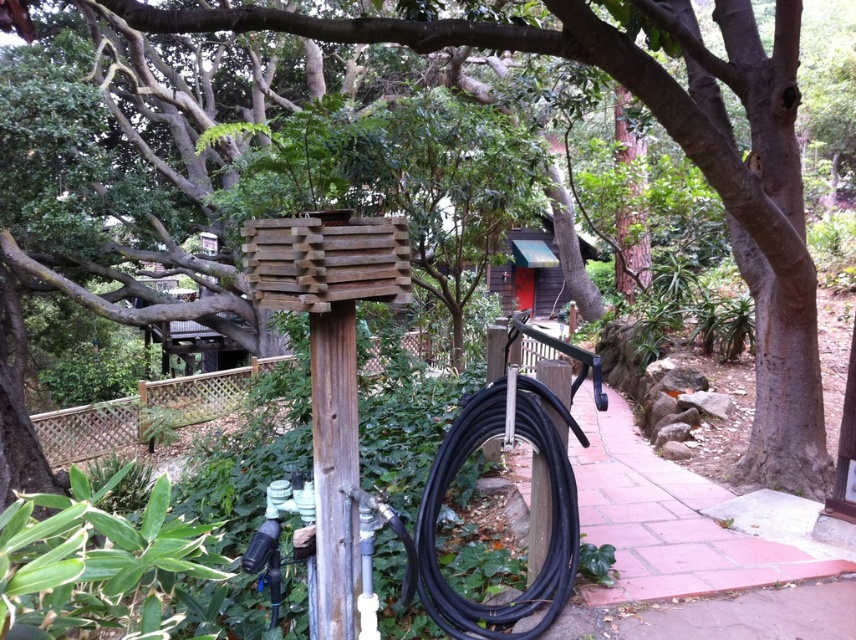
Does point (440, 488) come in front of point (535, 237)?

Yes, point (440, 488) is in front of point (535, 237).

Is point (547, 435) farther from camera compared to point (528, 227)?

That is False.

Who is more distant from viewer, (550, 396) or (510, 268)?

The point (510, 268) is more distant.

I want to click on black rubber hose at center, so click(551, 520).

Based on the photo, can you confirm if brown rough wood pole at center is wider than wooden hut at upper center?

No, brown rough wood pole at center is not wider than wooden hut at upper center.

Does brown rough wood pole at center have a lesser width compared to wooden hut at upper center?

Indeed, brown rough wood pole at center has a lesser width compared to wooden hut at upper center.

The image size is (856, 640). Describe the element at coordinates (334, 467) in the screenshot. I see `brown rough wood pole at center` at that location.

What are the coordinates of `brown rough wood pole at center` in the screenshot? It's located at (334, 467).

Does black rubber hose at center have a greater height compared to brown rough wood pole at center?

In fact, black rubber hose at center may be shorter than brown rough wood pole at center.

Does black rubber hose at center have a smaller size compared to brown rough wood pole at center?

No, black rubber hose at center is not smaller than brown rough wood pole at center.

Describe the element at coordinates (551, 520) in the screenshot. I see `black rubber hose at center` at that location.

Find the location of a particular element. The image size is (856, 640). black rubber hose at center is located at coordinates (551, 520).